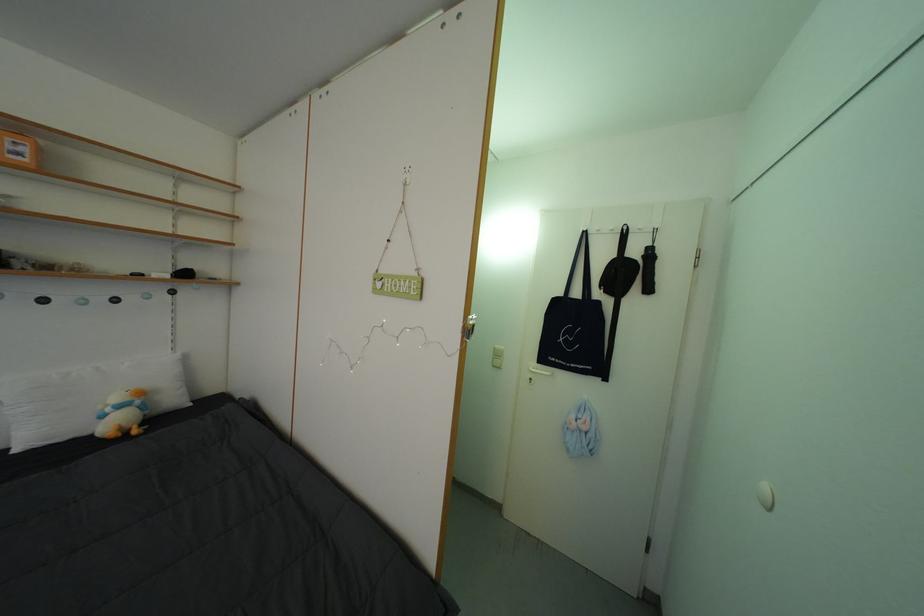
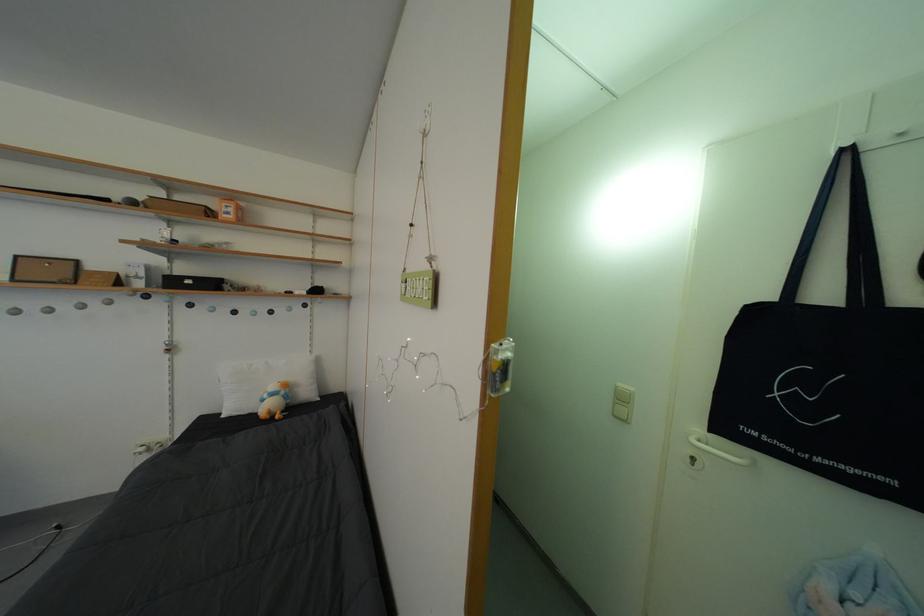
Question: In a continuous first-person perspective shot, in which direction is the camera moving?

Choices:
 (A) Left
 (B) Right
 (C) Forward
 (D) Backward

Answer: (C)